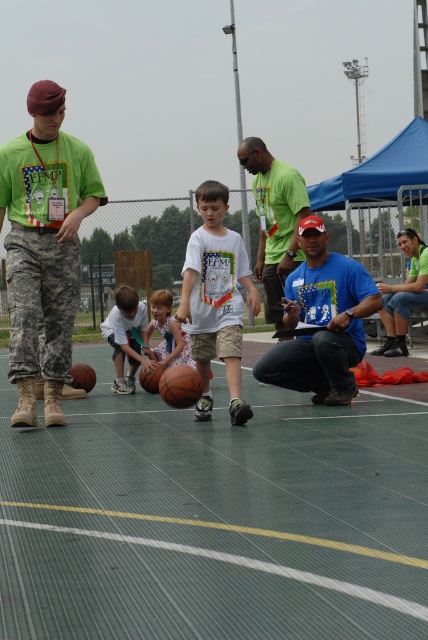
You are a photographer standing at the back of the basketball court. You want to take a photo of the matte orange basketball at center and the camouflage pants at left. Which object will appear closer to you in the photo?

The matte orange basketball at center will appear closer to you in the photo because it is positioned further to the viewer than the camouflage pants at left.